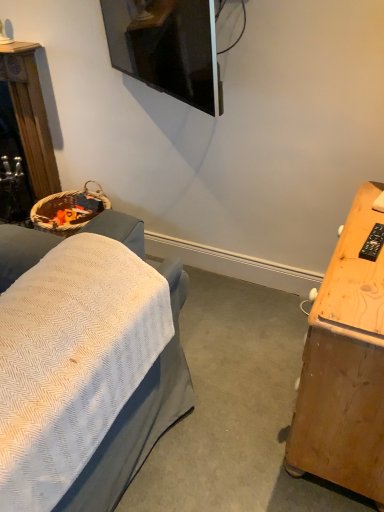
Question: In the image, is woven basket at left positioned in front of or behind light brown wood desk at right?

Choices:
 (A) behind
 (B) front

Answer: (A)

Question: Based on their positions, is woven basket at left located to the left or right of light brown wood desk at right?

Choices:
 (A) left
 (B) right

Answer: (A)

Question: Considering the positions of woven basket at left and light brown wood desk at right in the image, is woven basket at left taller or shorter than light brown wood desk at right?

Choices:
 (A) short
 (B) tall

Answer: (B)

Question: Is light brown wood desk at right taller or shorter than woven basket at left?

Choices:
 (A) tall
 (B) short

Answer: (B)

Question: In terms of width, does light brown wood desk at right look wider or thinner when compared to woven basket at left?

Choices:
 (A) wide
 (B) thin

Answer: (A)

Question: In the image, is light brown wood desk at right positioned in front of or behind woven basket at left?

Choices:
 (A) behind
 (B) front

Answer: (B)

Question: Looking at the image, does light brown wood desk at right seem bigger or smaller compared to woven basket at left?

Choices:
 (A) small
 (B) big

Answer: (B)